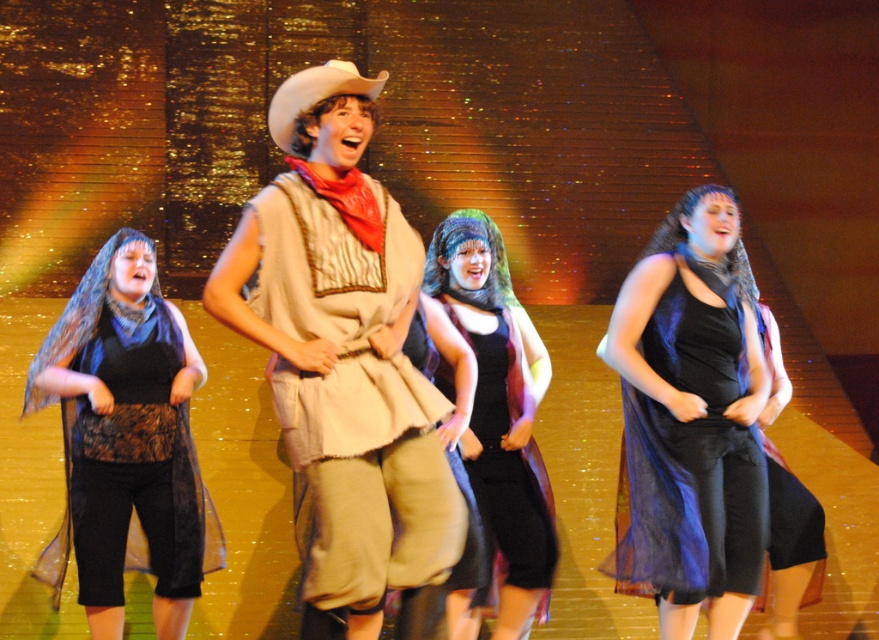
What is located at the coordinates point (x=692, y=417)?

The black sheer dress at center is located at point (x=692, y=417).

You are directing a stage play and need to position two important props. The first prop must be placed at point [347,74], and the second at point [461,269]. From the audience perspective, which prop will appear closer to them?

The prop placed at point [347,74] will appear closer to the audience because it is in front of the prop at point [461,269].